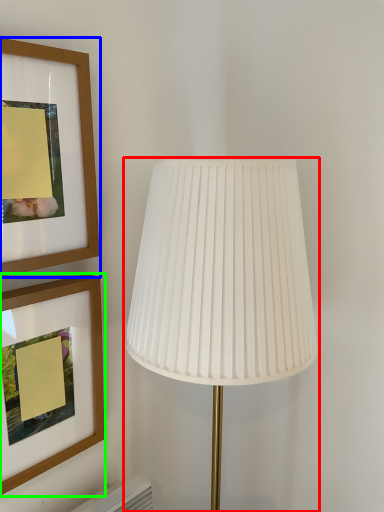
Question: Considering the real-world distances, which object is closest to lamp (highlighted by a red box)? picture frame (highlighted by a blue box) or picture frame (highlighted by a green box).

Choices:
 (A) picture frame
 (B) picture frame

Answer: (A)